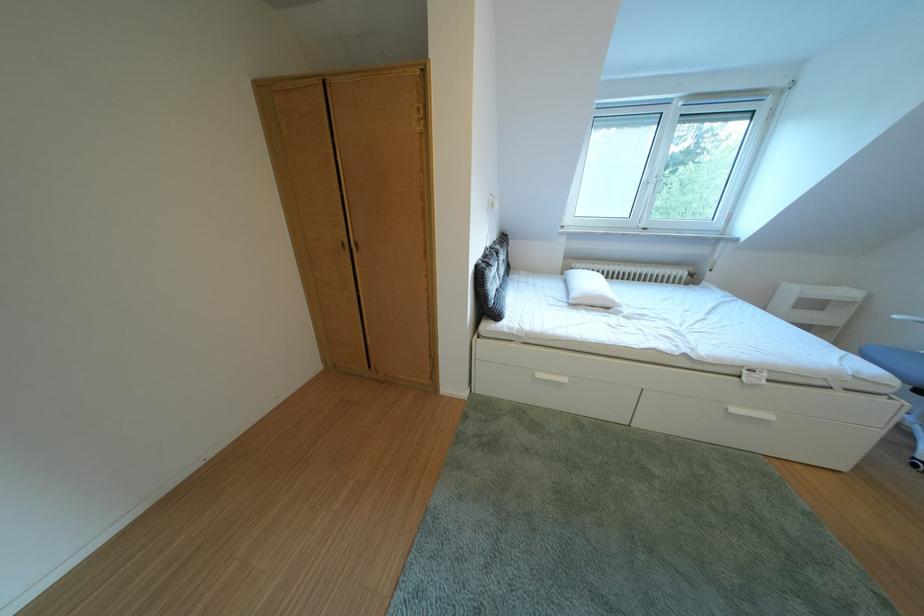
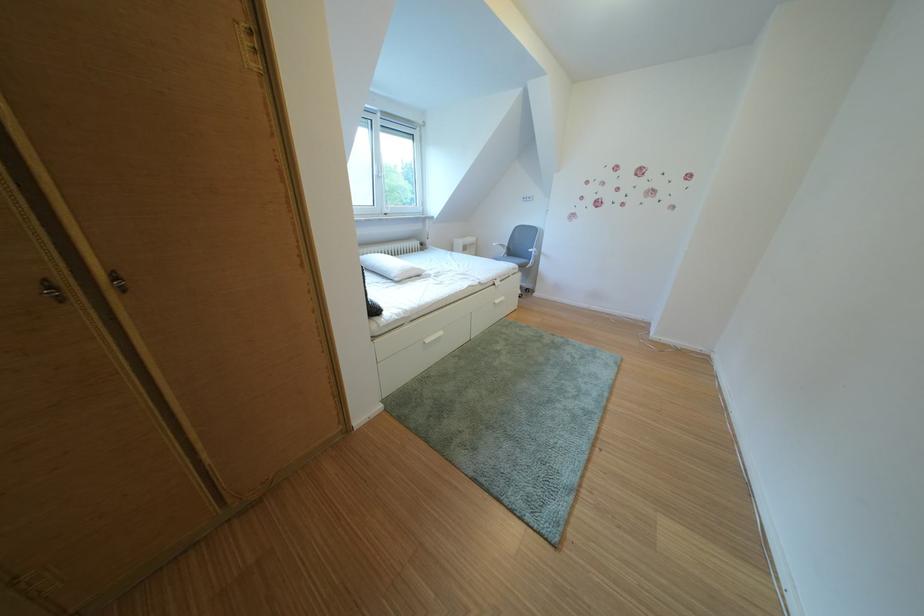
The point at (748, 415) is marked in the first image. Where is the corresponding point in the second image?

(511, 307)